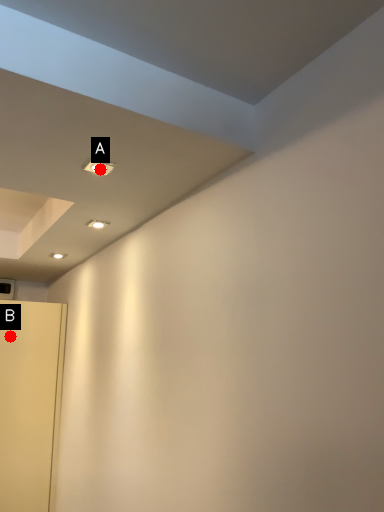
Question: Two points are circled on the image, labeled by A and B beside each circle. Which point is further to the camera?

Choices:
 (A) A is further
 (B) B is further

Answer: (B)